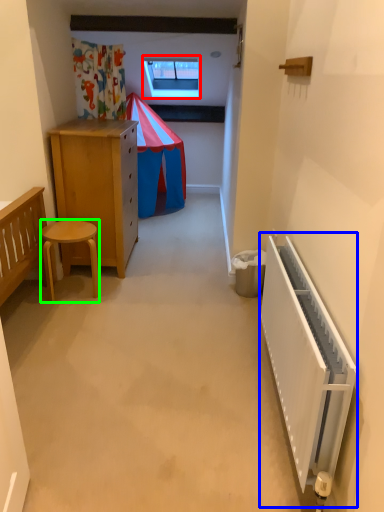
Question: Estimate the real-world distances between objects in this image. Which object is farther from window (highlighted by a red box), radiator (highlighted by a blue box) or stool (highlighted by a green box)?

Choices:
 (A) radiator
 (B) stool

Answer: (A)